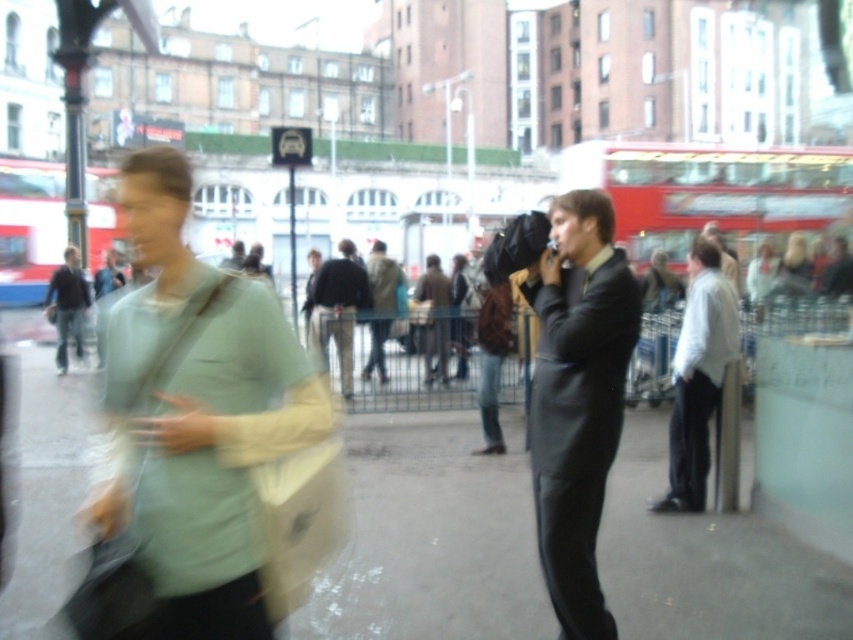
Based on the photo, based on the scene description, what type of surface is located at the coordinates point [432,536]?

The point [432,536] indicates smooth concrete pavement at center.

You are a photographer who just took a picture of a busy street. In the image, you see a dark gray suit at center and a dark brown leather jacket at center. Which one is positioned more to the right side of the image?

The dark gray suit at center is positioned more to the right side of the image compared to the dark brown leather jacket at center.

In the scene shown: You are a delivery person trying to locate a package that was accidentally dropped at the coordinates point (x=196, y=413). According to the scene description, what object is located at those coordinates?

The point (x=196, y=413) indicates the light green fabric bag at left.